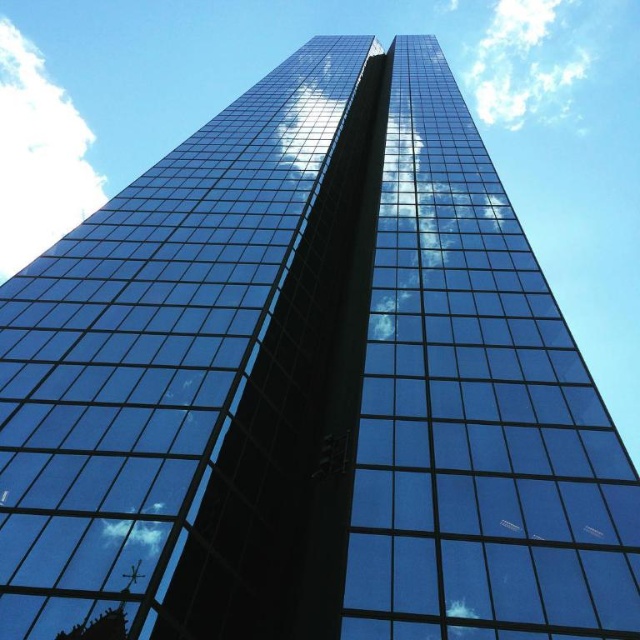
Question: Is white fluffy cloud at upper left smaller than white fluffy cloud at lower left?

Choices:
 (A) yes
 (B) no

Answer: (B)

Question: Can you confirm if white fluffy cloud at upper center is positioned below white fluffy cloud at lower left?

Choices:
 (A) yes
 (B) no

Answer: (B)

Question: Is white fluffy cloud at upper left to the left of white fluffy cloud at lower left from the viewer's perspective?

Choices:
 (A) no
 (B) yes

Answer: (B)

Question: Among these objects, which one is nearest to the camera?

Choices:
 (A) white fluffy cloud at upper left
 (B) white fluffy cloud at upper center
 (C) white fluffy cloud at lower left

Answer: (C)

Question: Which point appears closest to the camera in this image?

Choices:
 (A) (138, 524)
 (B) (4, 144)
 (C) (528, 108)

Answer: (A)

Question: Which point appears closest to the camera in this image?

Choices:
 (A) (42, 243)
 (B) (493, 10)

Answer: (B)